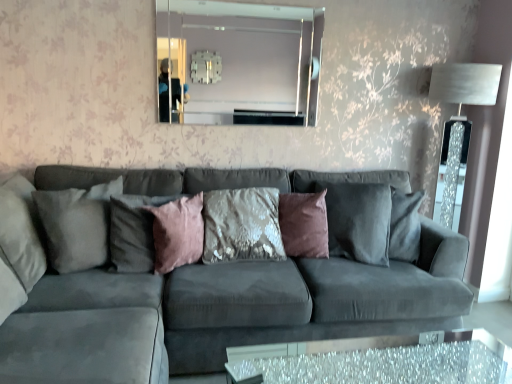
Question: Is point (225, 61) closer or farther from the camera than point (122, 200)?

Choices:
 (A) farther
 (B) closer

Answer: (A)

Question: From their relative heights in the image, would you say clear glass mirror at upper center is taller or shorter than pink velvet pillow at center, the 2th pillow positioned from the left?

Choices:
 (A) tall
 (B) short

Answer: (A)

Question: Which is farther from the velvet sequined pillow at center, which is the 1th pillow in right-to-left order?

Choices:
 (A) pink velvet pillow at center, acting as the third pillow starting from the right
 (B) velvet pink pillow at center, marked as the 2th pillow in a right-to-left arrangement
 (C) suede gray pillow at left, acting as the first pillow starting from the left
 (D) clear glass mirror at upper center
 (E) sparkly glass table at lower center

Answer: (C)

Question: Which of these objects is positioned closest to the pink velvet pillow at center, the 2th pillow positioned from the left?

Choices:
 (A) suede gray couch at center
 (B) sparkly glass table at lower center
 (C) velvet pink pillow at center, marked as the 2th pillow in a right-to-left arrangement
 (D) clear glass mirror at upper center
 (E) velvet sequined pillow at center, which is the 4th pillow from left to right

Answer: (C)